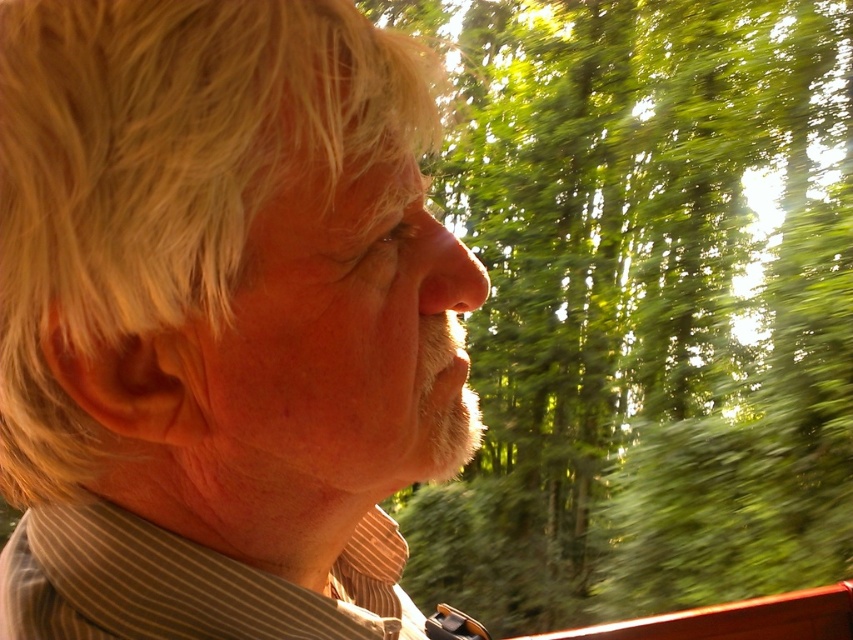
You are a photographer trying to capture a portrait of the person wearing the light brown striped shirt at center. The green leafy trees at upper right are part of the background. If you want to ensure that both the subject and the background are in focus, what should you consider about their distance?

The light brown striped shirt at center is 3.28 meters away from the green leafy trees at upper right. To have both in focus, the photographer needs to ensure that the depth of field is sufficient to cover this distance between the subject and the background.

You are a photographer trying to capture a sharp image of the subject in the scene described. The camera you are using has a depth of field that can only sharply focus on objects within 35 centimeters from the camera. Given the point at coordinates point (310, 348) is 37.75 centimeters away from the camera, will this point be in focus?

The point at coordinates point (310, 348) is 37.75 centimeters away from the camera, which is beyond the 35 centimeter depth of field range. Therefore, this point will not be in focus.

You are a photographer adjusting your camera settings. You want to focus on the light brown striped shirt at center while keeping the blurred green foliage in the background. What is the minimum distance the shirt should be from the camera to maintain this effect?

The light brown striped shirt at center is 33.36 centimeters away from the camera. To maintain the blurred background effect, the shirt should be at least 33.36 centimeters away from the camera.